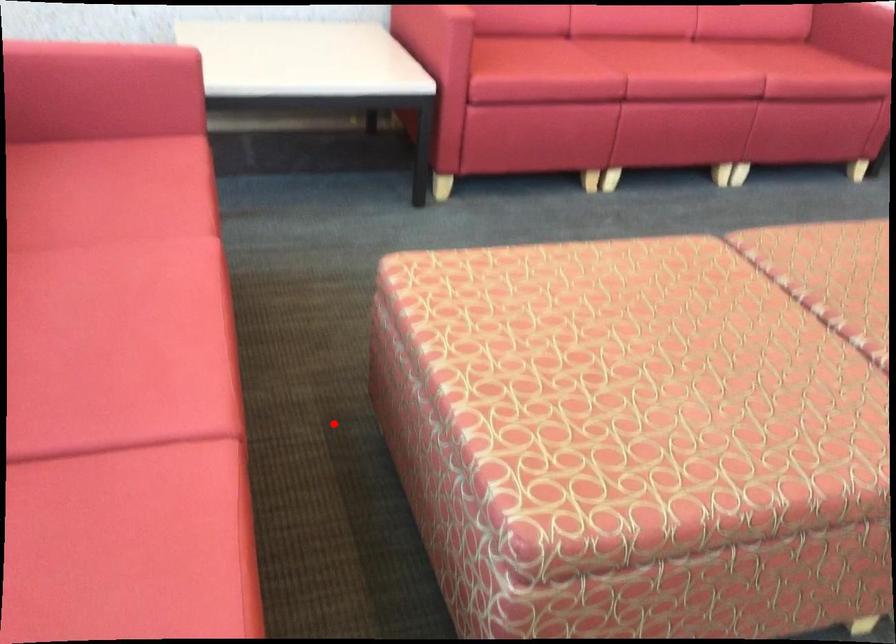
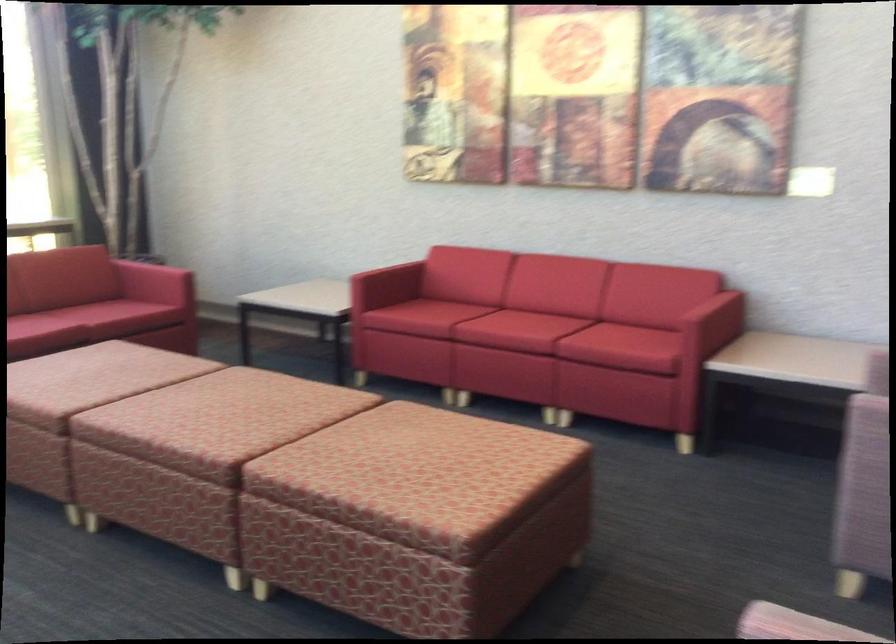
Question: I am providing you with two images of the same scene from different viewpoints. A red point is marked on the first image. Can you still see the location of the red point in image 2?

Choices:
 (A) Yes
 (B) No

Answer: (B)